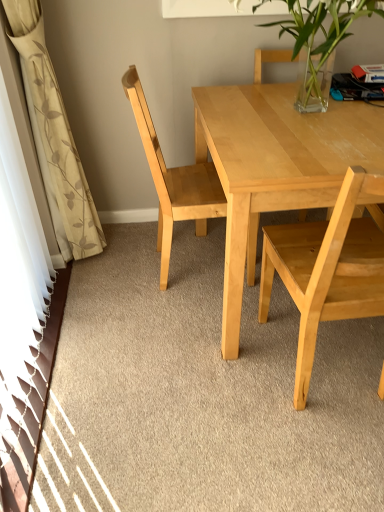
Image resolution: width=384 pixels, height=512 pixels. Identify the location of vacant region to the right of white floral fabric curtain at left. (137, 266).